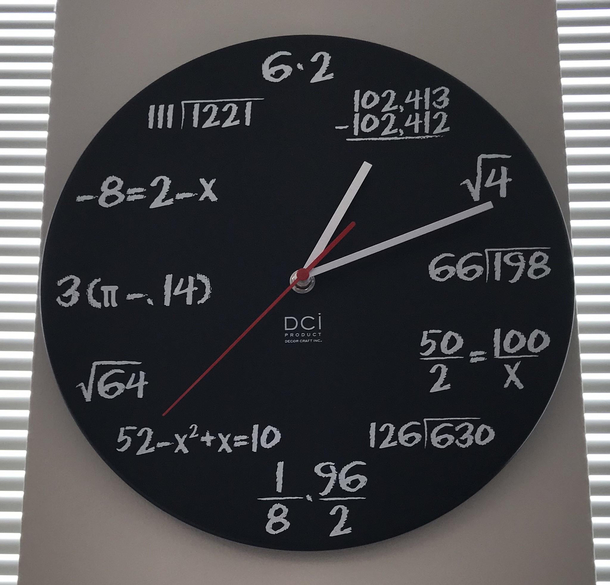
This screenshot has width=610, height=585. What are the coordinates of `back ground plaque for clock face` in the screenshot? It's located at (525, 534).